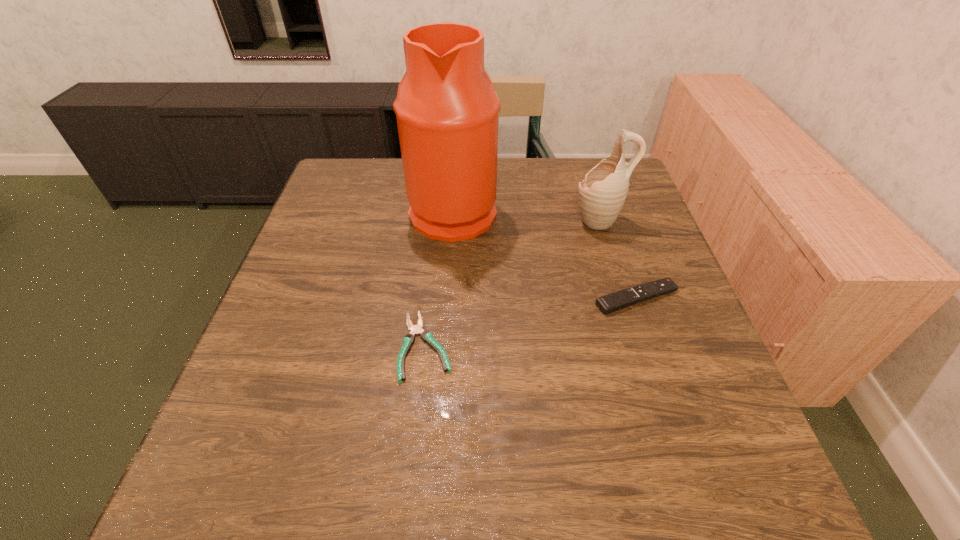
Locate an element on the screen. object that can be found as the third closest to the shortest object is located at coordinates (602, 193).

This screenshot has width=960, height=540. What are the coordinates of `vacant region that satisfies the following two spatial constraints: 1. from the spout of the tallest object; 2. on the right side of the remote control` in the screenshot? It's located at (447, 298).

At what (x,y) coordinates should I click in order to perform the action: click on free space that satisfies the following two spatial constraints: 1. on the back side of the remote control; 2. at the spout of the pitcher. Please return your answer as a coordinate pair (x, y). Looking at the image, I should click on (611, 221).

Identify the location of free spot that satisfies the following two spatial constraints: 1. from the spout of the water jug; 2. on the left side of the remote control. This screenshot has width=960, height=540. (447, 298).

Where is `vacant space that satisfies the following two spatial constraints: 1. on the back side of the third tallest object; 2. on the left side of the pliers`? vacant space that satisfies the following two spatial constraints: 1. on the back side of the third tallest object; 2. on the left side of the pliers is located at coordinates (432, 298).

Locate an element on the screen. This screenshot has width=960, height=540. vacant point that satisfies the following two spatial constraints: 1. from the spout of the second shortest object; 2. on the left side of the water jug is located at coordinates (447, 298).